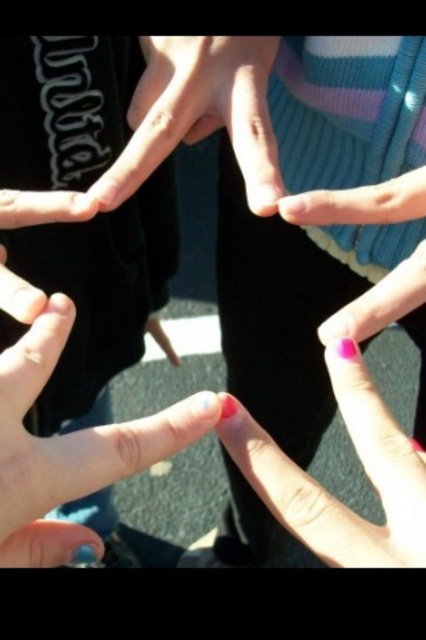
You are a photographer trying to capture the perfect shot of the hands forming a circle. The camera you are using has a focal length of 50mm. If the distance between the two points marked as point (393, 433) is critical for framing, and you know they are 10.02 inches apart, what is the angular size in degrees of this distance as seen through your camera lens?

The angular size can be calculated using the formula angular size in degrees equals the actual size divided by the focal length multiplied by 57.3. Plugging in the numbers, 10.02 inches divided by 50mm multiplied by 57.3 gives approximately 11.46 degrees. Therefore, the angular size is approximately 11.46 degrees.

You are a photographer trying to capture a close detail shot of the smooth skin hand at lower left. The camera you are using has a minimum focusing distance of 10 inches. Can you take the photo without moving the camera closer?

The distance between the smooth skin hand at lower left and the camera is 8.59 inches, which is less than the camera minimum focusing distance of 10 inches. Therefore, you cannot take the photo without moving the camera further away.

You are a photographer trying to capture the perfect shot of the interlocked hands. You notice the smooth skin hand at lower left and the smooth skin hand at center. Which hand should you focus on if you want to highlight a smaller hand in your composition?

The smooth skin hand at lower left should be focused on since it has a smaller size compared to the smooth skin hand at center, making it ideal for highlighting a smaller hand in the composition.